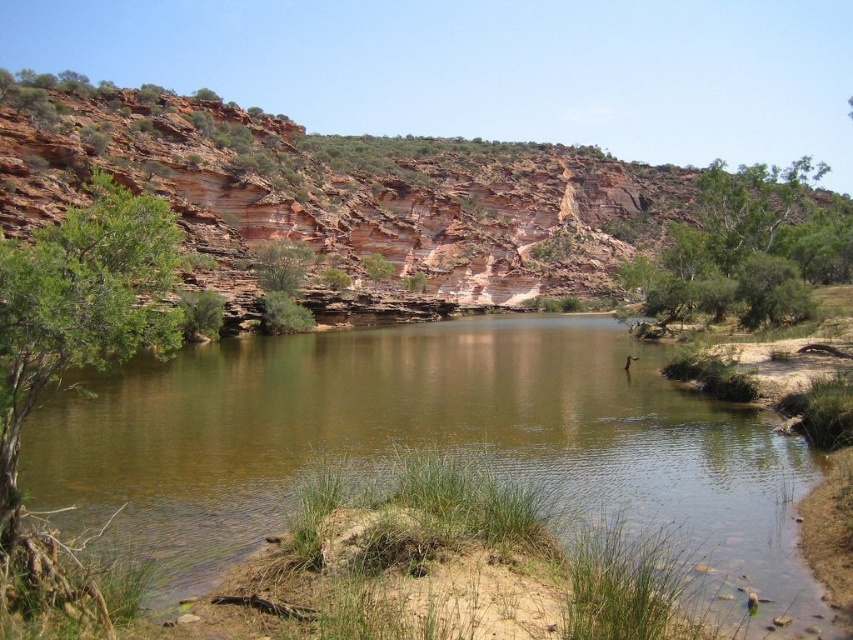
Question: Considering the real-world distances, which object is farthest from the green leafy tree at upper center?

Choices:
 (A) green leafy tree at center
 (B) reddish-brown rock cliff at upper center

Answer: (A)

Question: Is brown sedimentary rock at center positioned at the back of green leafy tree at left?

Choices:
 (A) no
 (B) yes

Answer: (B)

Question: Which object appears farthest from the camera in this image?

Choices:
 (A) green leafy tree at center
 (B) green leafy tree at upper center
 (C) reddish-brown rock cliff at upper center
 (D) green leafy tree at left

Answer: (A)

Question: Where is brown sedimentary rock at center located in relation to green leafy tree at left in the image?

Choices:
 (A) right
 (B) left

Answer: (A)

Question: Where is green leafy tree at left located in relation to green leafy tree at upper center in the image?

Choices:
 (A) left
 (B) right

Answer: (A)

Question: Which point is closer to the camera taking this photo?

Choices:
 (A) (41, 328)
 (B) (525, 212)

Answer: (A)